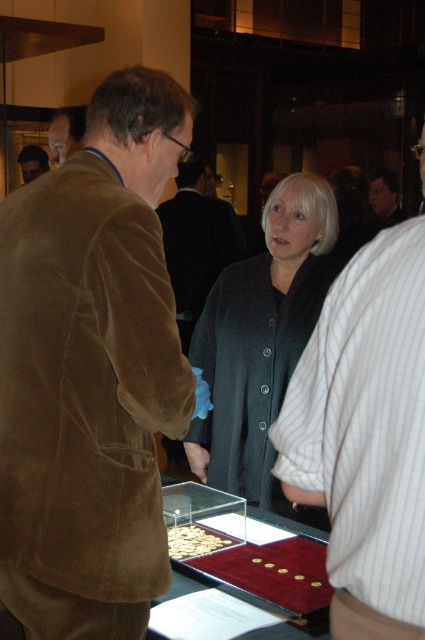
Can you confirm if suede jacket at left is positioned to the right of shiny gold coins at center?

In fact, suede jacket at left is to the left of shiny gold coins at center.

Is point (116, 179) in front of point (189, 545)?

Yes, point (116, 179) is in front of point (189, 545).

Locate an element on the screen. Image resolution: width=425 pixels, height=640 pixels. suede jacket at left is located at coordinates (91, 371).

What are the coordinates of `shiny gold coins at center` in the screenshot? It's located at (232, 572).

Is point (198, 524) positioned before point (53, 150)?

That is True.

At what (x,y) coordinates should I click in order to perform the action: click on shiny gold coins at center. Please return your answer as a coordinate pair (x, y). Looking at the image, I should click on (232, 572).

Does point (345, 288) come behind point (226, 536)?

No, (345, 288) is closer to viewer.

Is point (399, 570) in front of point (189, 531)?

Yes.

What are the coordinates of `white striped shirt at right` in the screenshot? It's located at (365, 436).